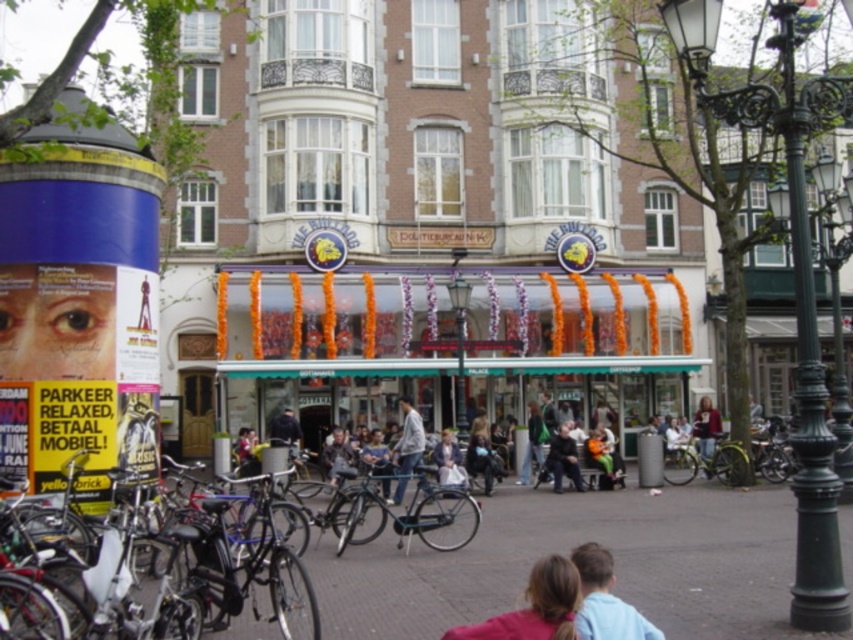
Is light brown hair at lower center further to camera compared to dark gray jacket at center?

No.

Is point (577, 547) less distant than point (563, 422)?

Yes, it is.

Identify the location of light brown hair at lower center. (605, 600).

Does point (798, 227) come farther from viewer compared to point (440, 524)?

No, (798, 227) is in front of (440, 524).

Based on the photo, is green cast iron streetlight at center taller than shiny blue bicycle at center?

Correct, green cast iron streetlight at center is much taller as shiny blue bicycle at center.

The height and width of the screenshot is (640, 853). I want to click on green cast iron streetlight at center, so click(x=793, y=280).

Is concrete pavement at center below blurred fabric jacket at center?

Indeed, concrete pavement at center is positioned under blurred fabric jacket at center.

Describe the element at coordinates (567, 554) in the screenshot. I see `concrete pavement at center` at that location.

Does point (496, 486) come farther from viewer compared to point (704, 413)?

That is False.

Identify the location of concrete pavement at center. (567, 554).